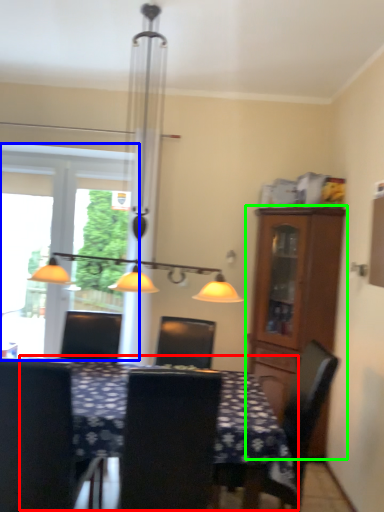
Question: Which is nearer to the table (highlighted by a red box)? window (highlighted by a blue box) or cabinetry (highlighted by a green box).

Choices:
 (A) window
 (B) cabinetry

Answer: (B)